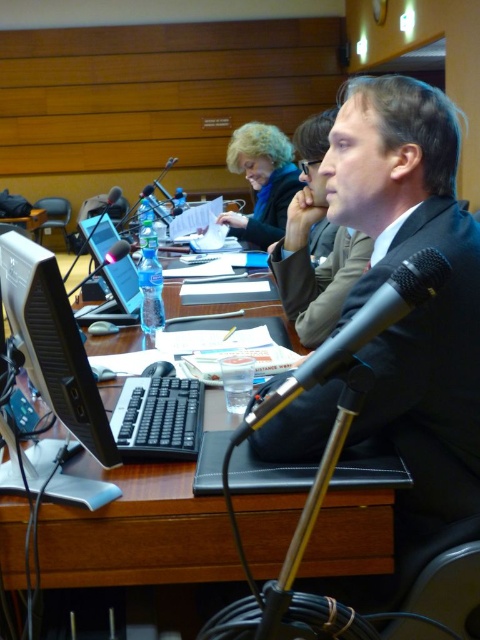
Question: Is the position of black metallic microphone at center less distant than that of matte black jacket at upper center?

Choices:
 (A) no
 (B) yes

Answer: (B)

Question: Among these points, which one is farthest from the camera?

Choices:
 (A) (296, 276)
 (B) (275, 236)
 (C) (105, 456)
 (D) (372, 314)

Answer: (B)

Question: Does black glossy monitor at center appear on the right side of black metallic microphone at center?

Choices:
 (A) yes
 (B) no

Answer: (B)

Question: Which object is positioned farthest from the matte black jacket at upper center?

Choices:
 (A) brown suit at center
 (B) black glossy monitor at center

Answer: (B)

Question: Among these points, which one is nearest to the camera?

Choices:
 (A) (21, 316)
 (B) (282, 252)
 (C) (260, 147)
 (D) (405, 268)

Answer: (D)

Question: Can you confirm if brown suit at center is bigger than matte black jacket at upper center?

Choices:
 (A) no
 (B) yes

Answer: (A)